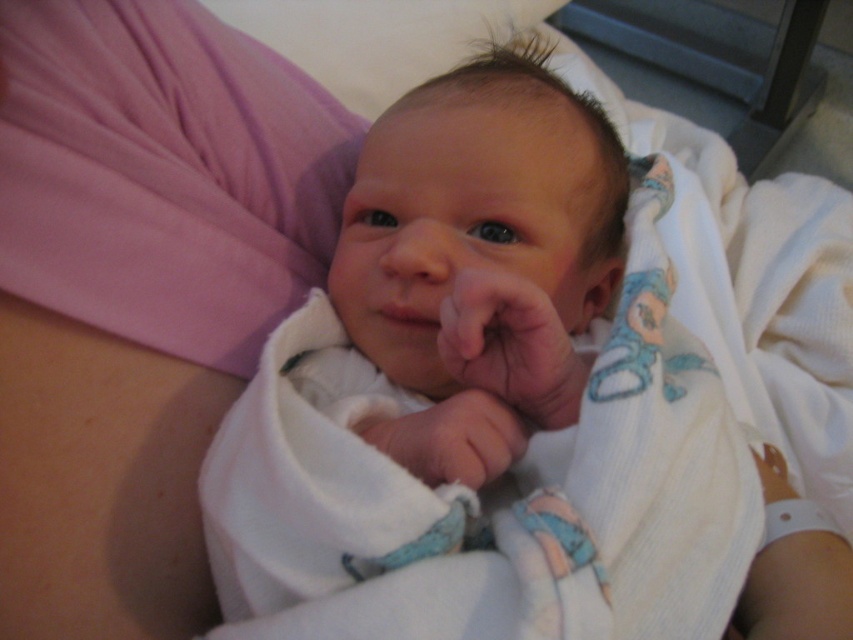
You are a photographer taking a closeup shot of a newborn baby. You notice the white soft swaddle at center and the white soft fabric hand at center in the frame. Which object is wider in the image?

The white soft swaddle at center is wider than the white soft fabric hand at center according to the description.

You are a healthcare professional checking the baby for potential skin conditions. You notice the smooth skin hand at center and the white soft fabric hand at center. Which hand is closer to the camera?

The smooth skin hand at center is closer to the camera than the white soft fabric hand at center because there is a distance of 1.42 inches between them.

You are a photographer taking a closeup shot of a newborn baby. You need to ensure that both the white soft swaddle at center and the smooth skin hand at center are visible in the frame. Based on their positions, which object should you adjust your focus towards if the hand is currently slightly out of frame?

The white soft swaddle at center is to the right of the smooth skin hand at center. To include the hand in the frame, you should adjust your focus slightly to the left to ensure the smooth skin hand at center is fully visible while keeping the white soft swaddle at center in view.